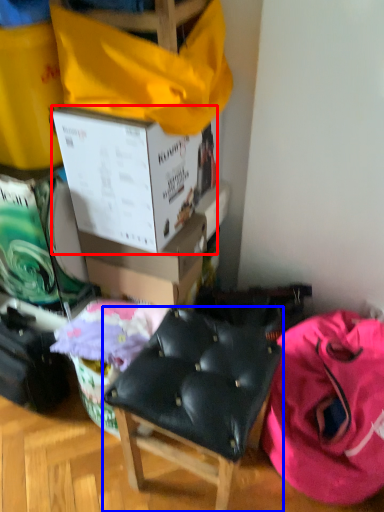
Question: Which object appears farthest to the camera in this image, box (highlighted by a red box) or chair (highlighted by a blue box)?

Choices:
 (A) box
 (B) chair

Answer: (A)